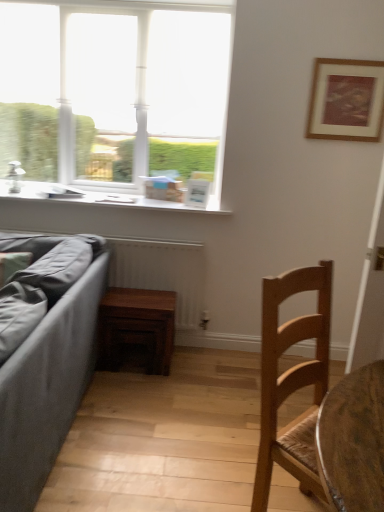
Question: From the image's perspective, is wooden radiator at lower left over wooden chair at lower right?

Choices:
 (A) yes
 (B) no

Answer: (A)

Question: From the image's perspective, is wooden radiator at lower left under wooden chair at lower right?

Choices:
 (A) no
 (B) yes

Answer: (A)

Question: Is wooden radiator at lower left oriented towards wooden chair at lower right?

Choices:
 (A) yes
 (B) no

Answer: (A)

Question: Could wooden chair at lower right be considered to be inside wooden radiator at lower left?

Choices:
 (A) no
 (B) yes

Answer: (A)

Question: Is wooden radiator at lower left positioned in front of wooden chair at lower right?

Choices:
 (A) no
 (B) yes

Answer: (A)

Question: Considering the relative sizes of wooden radiator at lower left and wooden chair at lower right in the image provided, is wooden radiator at lower left shorter than wooden chair at lower right?

Choices:
 (A) no
 (B) yes

Answer: (B)

Question: Are wooden chair at lower right and dark wood table at center located far from each other?

Choices:
 (A) yes
 (B) no

Answer: (A)

Question: Considering the relative sizes of wooden chair at lower right and dark wood table at center in the image provided, is wooden chair at lower right taller than dark wood table at center?

Choices:
 (A) no
 (B) yes

Answer: (B)

Question: Is wooden chair at lower right positioned in front of dark wood table at center?

Choices:
 (A) yes
 (B) no

Answer: (A)

Question: Is wooden chair at lower right at the right side of dark wood table at center?

Choices:
 (A) no
 (B) yes

Answer: (B)

Question: Is wooden chair at lower right bigger than dark wood table at center?

Choices:
 (A) yes
 (B) no

Answer: (A)

Question: From a real-world perspective, is wooden chair at lower right located beneath dark wood table at center?

Choices:
 (A) no
 (B) yes

Answer: (A)

Question: From the image's perspective, is wooden radiator at lower left located beneath wooden framed artwork at upper right?

Choices:
 (A) no
 (B) yes

Answer: (B)